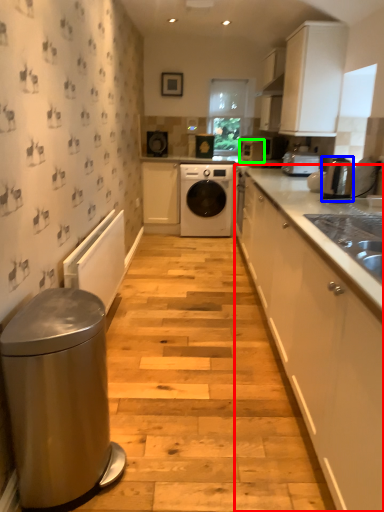
Question: Which object is positioned farthest from cabinetry (highlighted by a red box)? Select from home appliance (highlighted by a blue box) and appliance (highlighted by a green box).

Choices:
 (A) home appliance
 (B) appliance

Answer: (B)